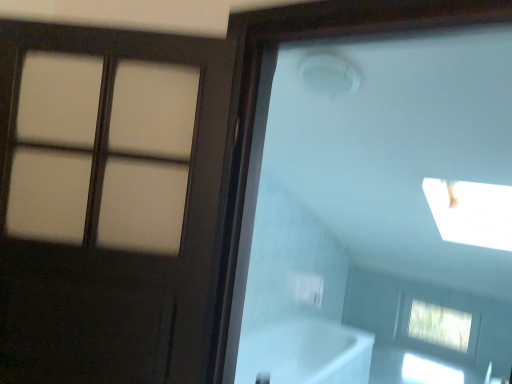
Question: From the image's perspective, would you say matte brown door at left is positioned over clear glass window at lower right?

Choices:
 (A) no
 (B) yes

Answer: (B)

Question: Is matte brown door at left aimed at clear glass window at lower right?

Choices:
 (A) no
 (B) yes

Answer: (A)

Question: Can you confirm if matte brown door at left is shorter than clear glass window at lower right?

Choices:
 (A) yes
 (B) no

Answer: (B)

Question: Is clear glass window at lower right at the back of matte brown door at left?

Choices:
 (A) yes
 (B) no

Answer: (B)

Question: Can you confirm if matte brown door at left is positioned to the left of clear glass window at lower right?

Choices:
 (A) yes
 (B) no

Answer: (A)

Question: Is matte brown door at left wider or thinner than clear glass window at lower right?

Choices:
 (A) wide
 (B) thin

Answer: (B)

Question: From the image's perspective, relative to clear glass window at lower right, is matte brown door at left above or below?

Choices:
 (A) below
 (B) above

Answer: (B)

Question: Is matte brown door at left inside or outside of clear glass window at lower right?

Choices:
 (A) inside
 (B) outside

Answer: (B)

Question: From a real-world perspective, relative to clear glass window at lower right, is matte brown door at left vertically above or below?

Choices:
 (A) above
 (B) below

Answer: (A)

Question: From their relative heights in the image, would you say matte brown door at left is taller or shorter than white glossy bathtub at lower center?

Choices:
 (A) short
 (B) tall

Answer: (B)

Question: Considering the positions of point (90, 284) and point (240, 357), is point (90, 284) closer or farther from the camera than point (240, 357)?

Choices:
 (A) closer
 (B) farther

Answer: (A)

Question: Looking at the image, does matte brown door at left seem bigger or smaller compared to white glossy bathtub at lower center?

Choices:
 (A) small
 (B) big

Answer: (A)

Question: In terms of width, does matte brown door at left look wider or thinner when compared to white glossy bathtub at lower center?

Choices:
 (A) thin
 (B) wide

Answer: (A)

Question: From a real-world perspective, is white glossy bathtub at lower center positioned above or below clear glass window at lower right?

Choices:
 (A) above
 (B) below

Answer: (B)

Question: Do you think white glossy bathtub at lower center is within clear glass window at lower right, or outside of it?

Choices:
 (A) outside
 (B) inside

Answer: (A)